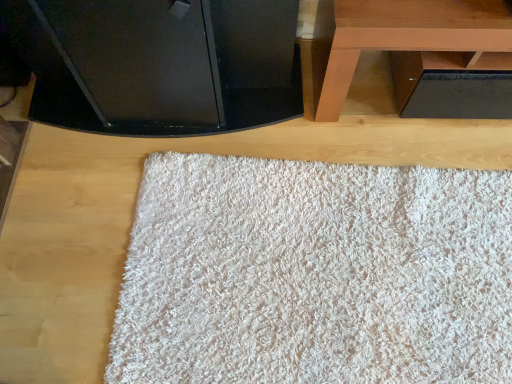
Question: Does black glossy tv at upper center come in front of white fluffy rug at center?

Choices:
 (A) no
 (B) yes

Answer: (B)

Question: Does black glossy tv at upper center lie behind white fluffy rug at center?

Choices:
 (A) yes
 (B) no

Answer: (B)

Question: Is black glossy tv at upper center at the right side of white fluffy rug at center?

Choices:
 (A) yes
 (B) no

Answer: (B)

Question: Is black glossy tv at upper center completely or partially outside of white fluffy rug at center?

Choices:
 (A) no
 (B) yes

Answer: (B)

Question: Considering the relative sizes of black glossy tv at upper center and white fluffy rug at center in the image provided, is black glossy tv at upper center taller than white fluffy rug at center?

Choices:
 (A) no
 (B) yes

Answer: (B)

Question: Can you confirm if black glossy tv at upper center is bigger than white fluffy rug at center?

Choices:
 (A) no
 (B) yes

Answer: (B)

Question: Can you confirm if white fluffy rug at center is thinner than brown wooden table at upper right?

Choices:
 (A) yes
 (B) no

Answer: (B)

Question: Considering the relative sizes of white fluffy rug at center and brown wooden table at upper right in the image provided, is white fluffy rug at center wider than brown wooden table at upper right?

Choices:
 (A) no
 (B) yes

Answer: (B)

Question: From the image's perspective, does white fluffy rug at center appear higher than brown wooden table at upper right?

Choices:
 (A) no
 (B) yes

Answer: (A)

Question: Is white fluffy rug at center placed right next to brown wooden table at upper right?

Choices:
 (A) yes
 (B) no

Answer: (B)

Question: Is white fluffy rug at center behind brown wooden table at upper right?

Choices:
 (A) no
 (B) yes

Answer: (B)

Question: From the image's perspective, is white fluffy rug at center below brown wooden table at upper right?

Choices:
 (A) no
 (B) yes

Answer: (B)

Question: Is brown wooden table at upper right far away from black glossy tv at upper center?

Choices:
 (A) yes
 (B) no

Answer: (B)